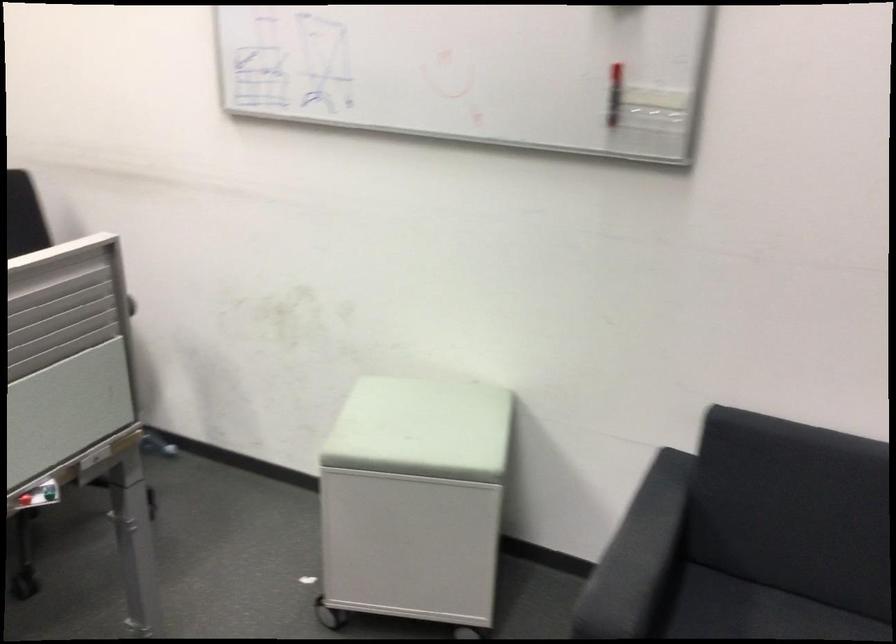
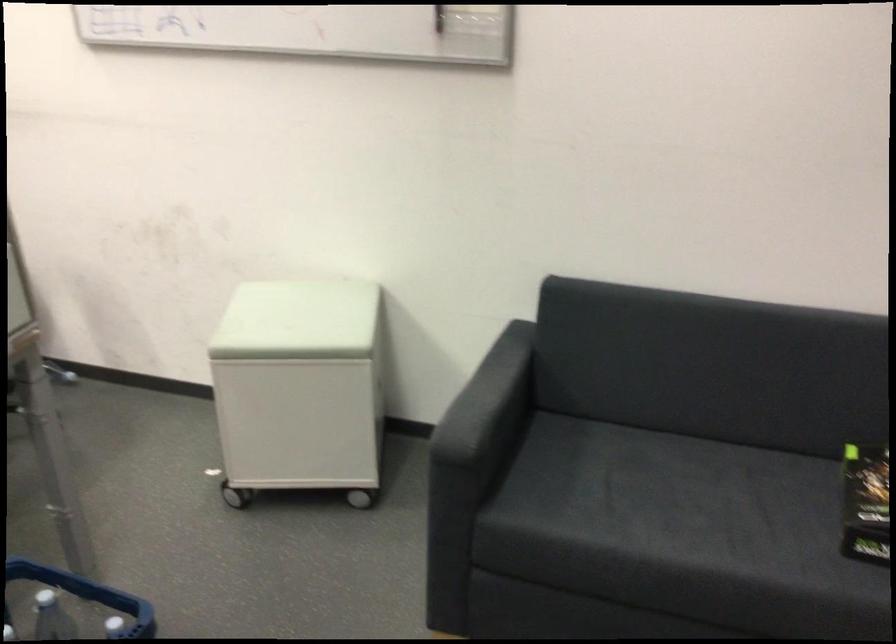
Where in the second image is the point corresponding to (x=640, y=560) from the first image?

(487, 401)